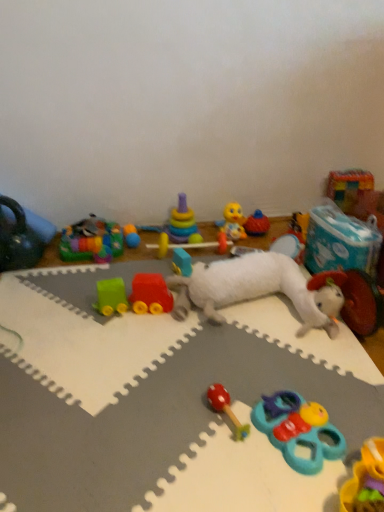
Identify the location of free space to the left of rubberized plastic toy at center, which is the tenth toy in right-to-left order. (147, 256).